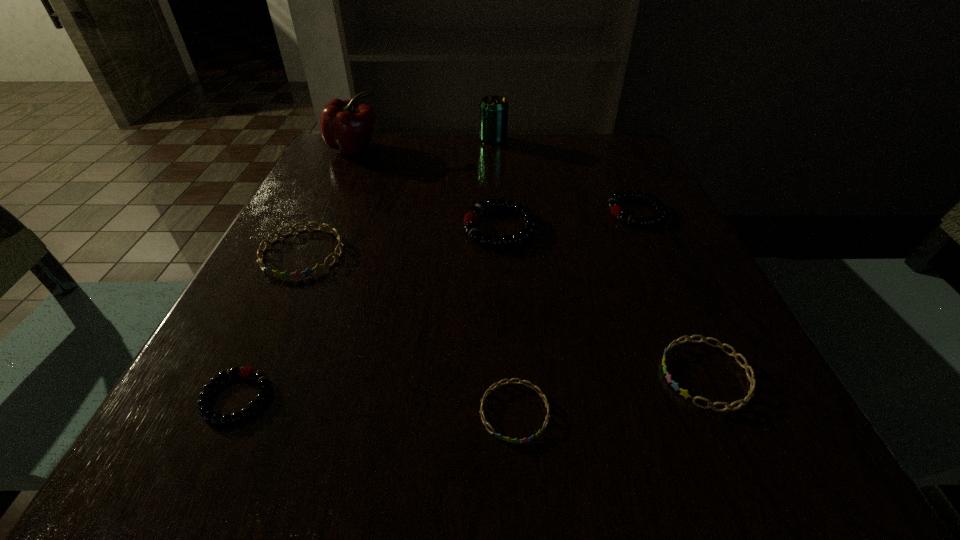
Locate an element on the screen. the tallest object is located at coordinates (345, 125).

You are a GUI agent. You are given a task and a screenshot of the screen. Output one action in this format:
    pyautogui.click(x=<x>, y=<y>)
    Task: Click on the pink pepper
    
    Given the screenshot: What is the action you would take?
    pyautogui.click(x=345, y=125)

What are the coordinates of `beer can` in the screenshot? It's located at (493, 109).

The image size is (960, 540). What are the coordinates of `green beer can` in the screenshot? It's located at (493, 109).

Find the location of a particular element. the second black bracelet from left to right is located at coordinates (477, 236).

The height and width of the screenshot is (540, 960). I want to click on the leftmost blue bracelet, so click(307, 272).

The height and width of the screenshot is (540, 960). What are the coordinates of `the farthest blue bracelet` in the screenshot? It's located at (307, 272).

Locate an element on the screen. the rightmost black bracelet is located at coordinates (616, 210).

The width and height of the screenshot is (960, 540). What are the coordinates of `the rightmost blue bracelet` in the screenshot? It's located at (752, 379).

The width and height of the screenshot is (960, 540). Find the location of `the leftmost black bracelet`. the leftmost black bracelet is located at coordinates (205, 411).